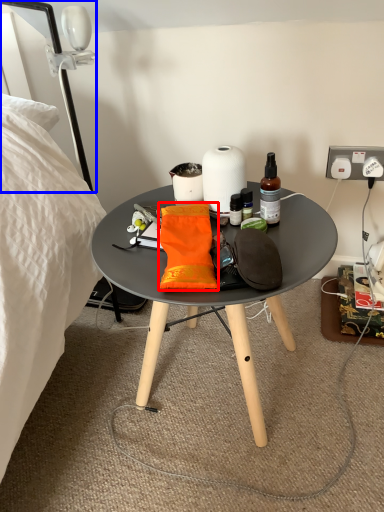
Question: Which object is further to the camera taking this photo, material (highlighted by a red box) or lamp (highlighted by a blue box)?

Choices:
 (A) material
 (B) lamp

Answer: (B)